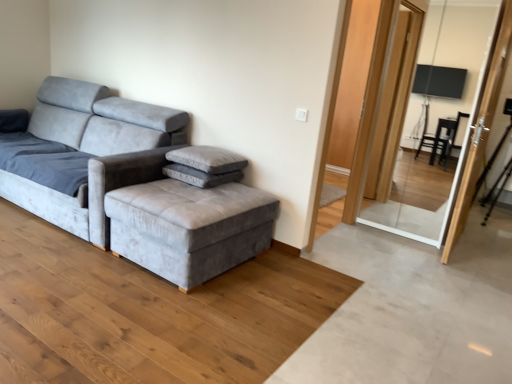
Identify the location of vacant space in front of velvet grey ottoman at center. This screenshot has height=384, width=512. (148, 320).